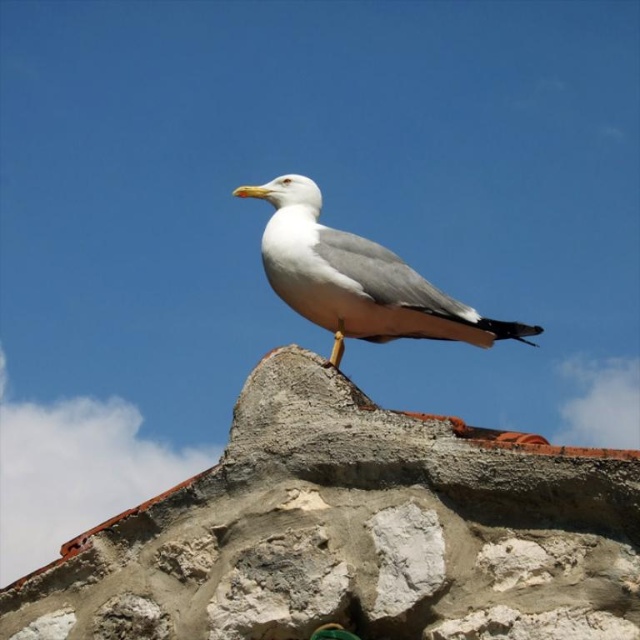
Question: Which of the following is the closest to the observer?

Choices:
 (A) (300, 236)
 (B) (502, 573)

Answer: (B)

Question: Is rough concrete stone at center positioned before white feathered seagull at center?

Choices:
 (A) no
 (B) yes

Answer: (B)

Question: Is rough concrete stone at center thinner than white feathered seagull at center?

Choices:
 (A) yes
 (B) no

Answer: (B)

Question: Is rough concrete stone at center behind white feathered seagull at center?

Choices:
 (A) yes
 (B) no

Answer: (B)

Question: Among these objects, which one is nearest to the camera?

Choices:
 (A) white feathered seagull at center
 (B) rough concrete stone at center

Answer: (B)